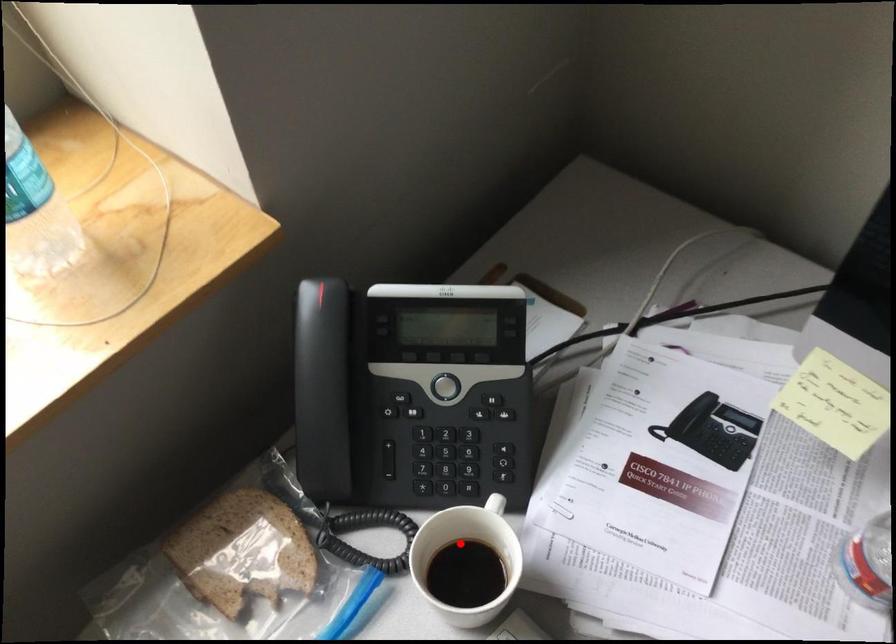
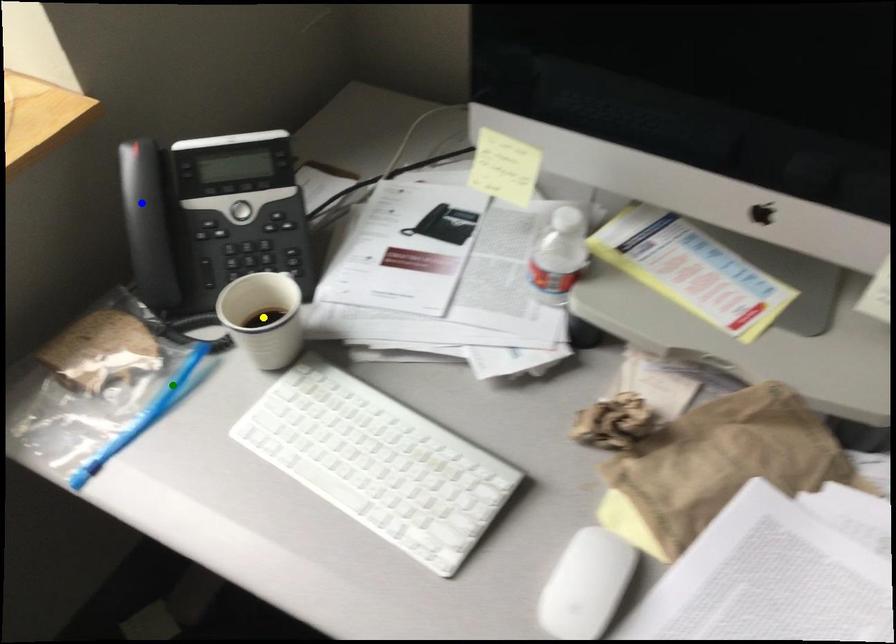
Question: I am providing you with two images of the same scene from different viewpoints. A red point is marked on the first image. You are given multiple points on the second image. Which spot in image 2 lines up with the point in image 1?

Choices:
 (A) blue point
 (B) green point
 (C) yellow point

Answer: (C)